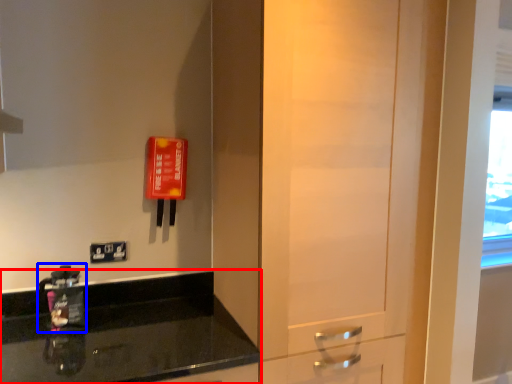
Question: Among these objects, which one is nearest to the camera, countertop (highlighted by a red box) or appliance (highlighted by a blue box)?

Choices:
 (A) countertop
 (B) appliance

Answer: (A)